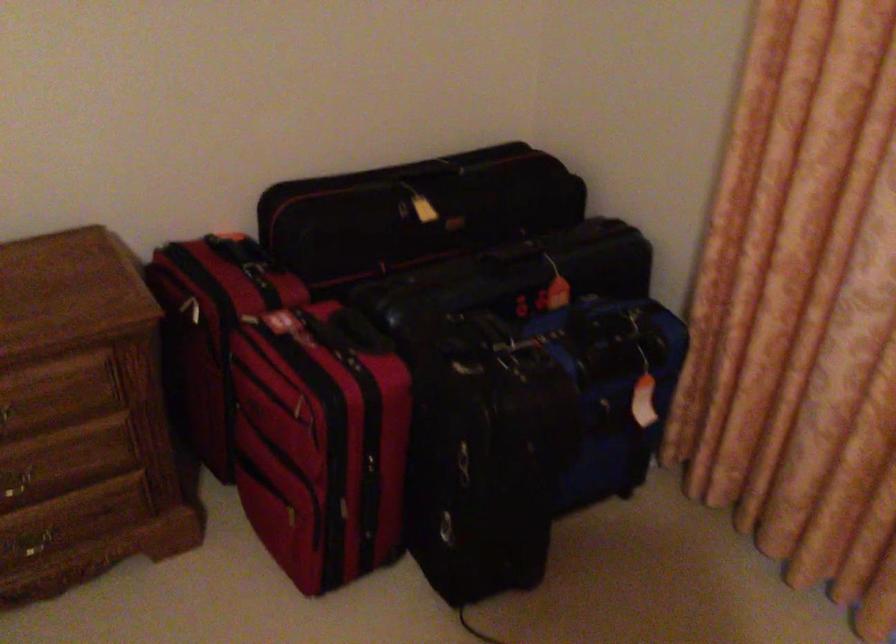
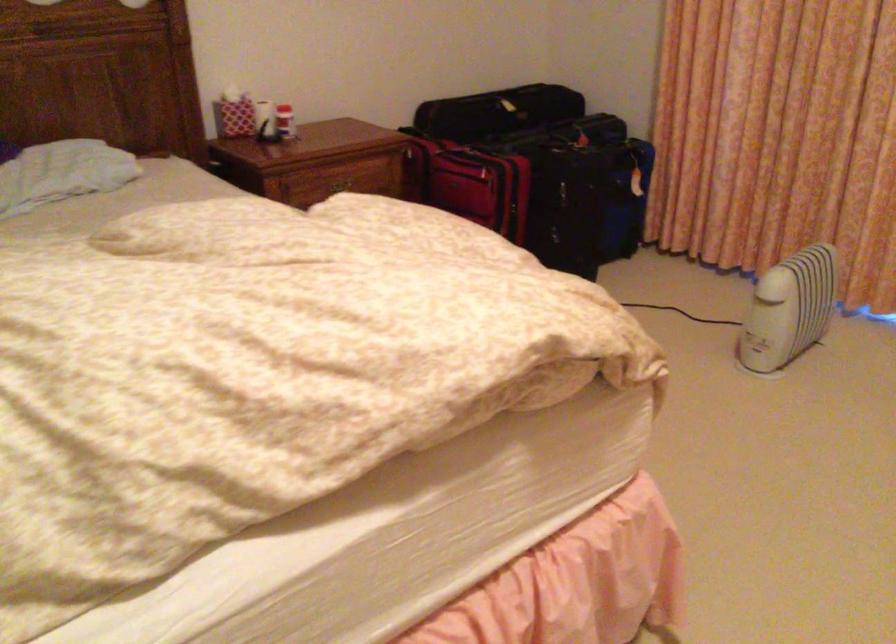
In the second image, find the point that corresponds to point (471, 491) in the first image.

(566, 205)